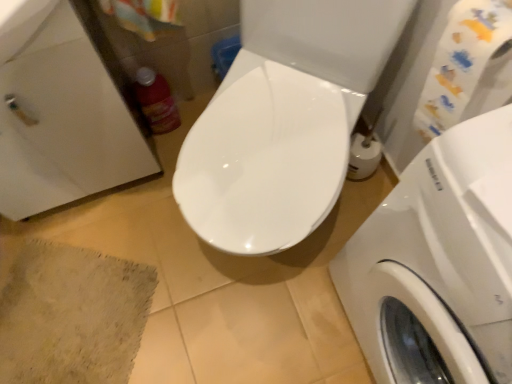
I want to click on vacant space to the right of beige textured bath mat at lower left, so click(x=206, y=303).